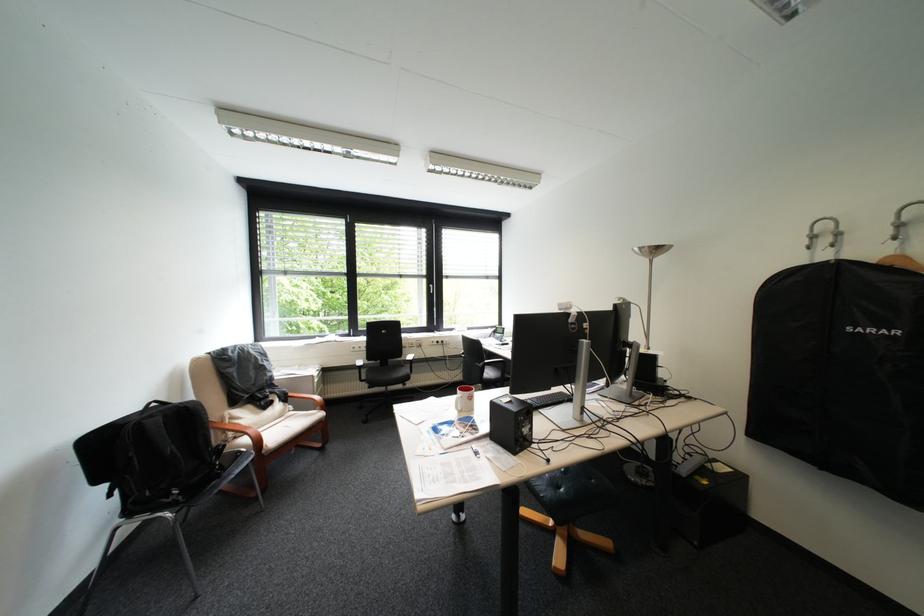
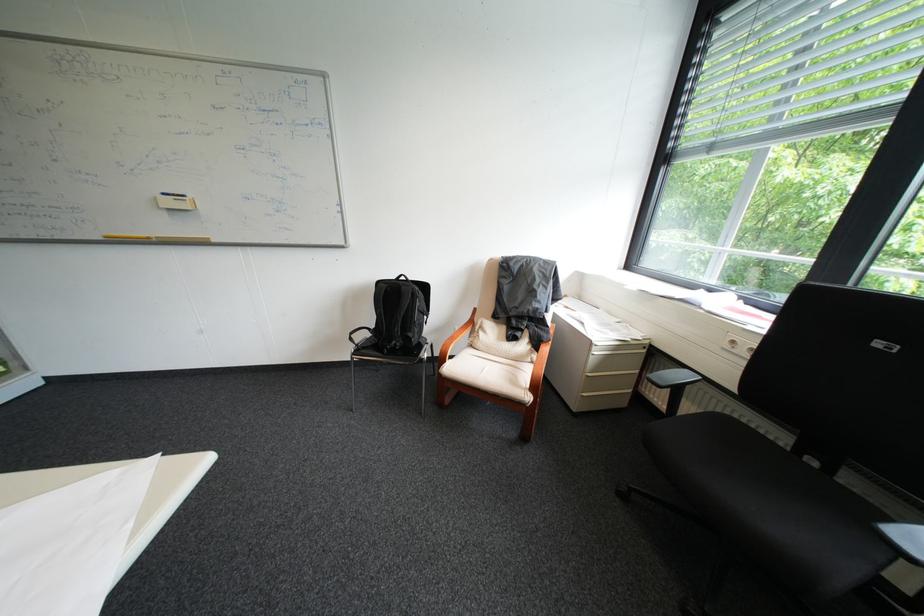
Find the pixel in the second image that matches the point at 271,443 in the first image.

(456, 360)